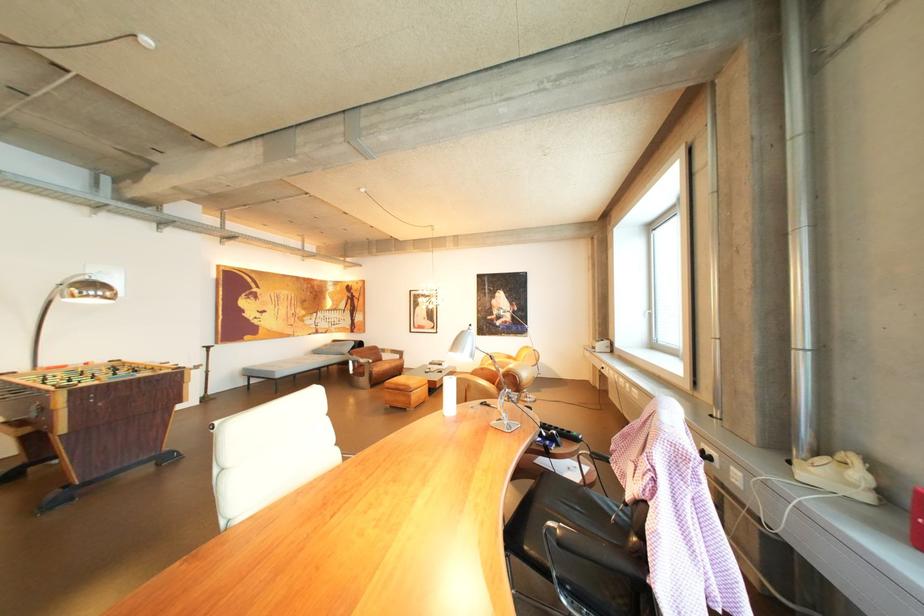
What are the coordinates of `tan chair sitting surface` in the screenshot? It's located at (383, 363).